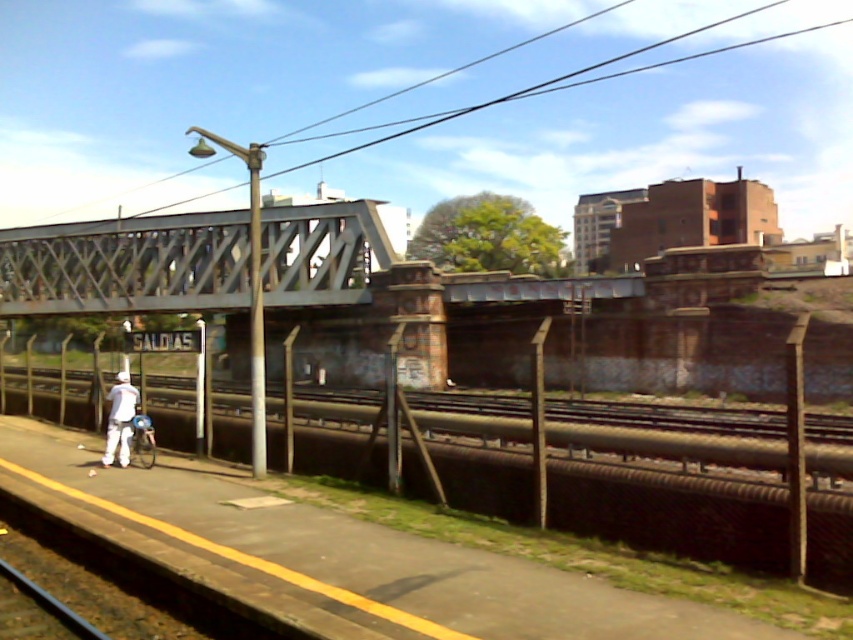
Can you confirm if metallic gray bridge at upper center is wider than white matte pants at lower left?

Yes.

Measure the distance between metallic gray bridge at upper center and camera.

A distance of 43.01 meters exists between metallic gray bridge at upper center and camera.

Is point (172, 220) closer to viewer compared to point (109, 394)?

No, it is not.

At what (x,y) coordinates should I click in order to perform the action: click on metallic gray bridge at upper center. Please return your answer as a coordinate pair (x, y). This screenshot has height=640, width=853. Looking at the image, I should click on (126, 266).

Can you confirm if smooth metal rail at center is shorter than metallic gray bridge at upper center?

Correct, smooth metal rail at center is not as tall as metallic gray bridge at upper center.

Can you confirm if smooth metal rail at center is positioned to the right of metallic gray bridge at upper center?

Correct, you'll find smooth metal rail at center to the right of metallic gray bridge at upper center.

Is point (647, 518) positioned before point (109, 266)?

Yes, point (647, 518) is closer to viewer.

At what (x,y) coordinates should I click in order to perform the action: click on smooth metal rail at center. Please return your answer as a coordinate pair (x, y). The width and height of the screenshot is (853, 640). Looking at the image, I should click on (671, 513).

Who is lower down, smooth metal rail at center or white matte pants at lower left?

Positioned lower is smooth metal rail at center.

Who is shorter, smooth metal rail at center or white matte pants at lower left?

smooth metal rail at center is shorter.

You are a GUI agent. You are given a task and a screenshot of the screen. Output one action in this format:
    pyautogui.click(x=<x>, y=<y>)
    Task: Click on the smooth metal rail at center
    Image resolution: width=853 pixels, height=640 pixels.
    Given the screenshot: What is the action you would take?
    pyautogui.click(x=671, y=513)